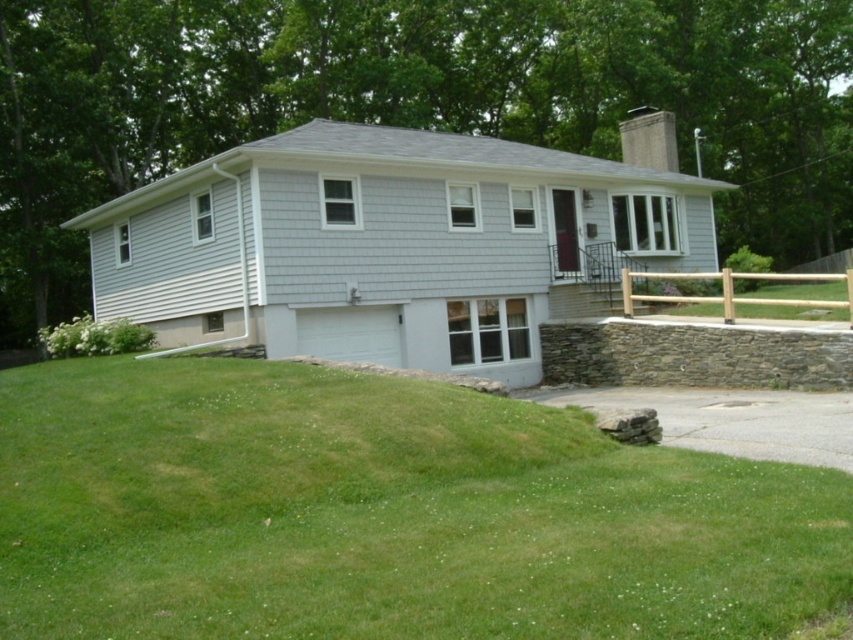
Question: Is green grass at lower left to the right of gray asphalt driveway at lower right from the viewer's perspective?

Choices:
 (A) no
 (B) yes

Answer: (A)

Question: Does green grass at lower left come in front of brown wooden fence at right?

Choices:
 (A) no
 (B) yes

Answer: (B)

Question: Among these points, which one is farthest from the camera?

Choices:
 (A) pos(749,428)
 (B) pos(846,308)

Answer: (B)

Question: Considering the real-world distances, which object is farthest from the gray asphalt driveway at lower right?

Choices:
 (A) brown wooden fence at right
 (B) green grass at lower left

Answer: (A)

Question: Does gray asphalt driveway at lower right appear over brown wooden fence at right?

Choices:
 (A) no
 (B) yes

Answer: (A)

Question: Which of the following is the farthest from the observer?

Choices:
 (A) brown wooden fence at right
 (B) gray asphalt driveway at lower right

Answer: (A)